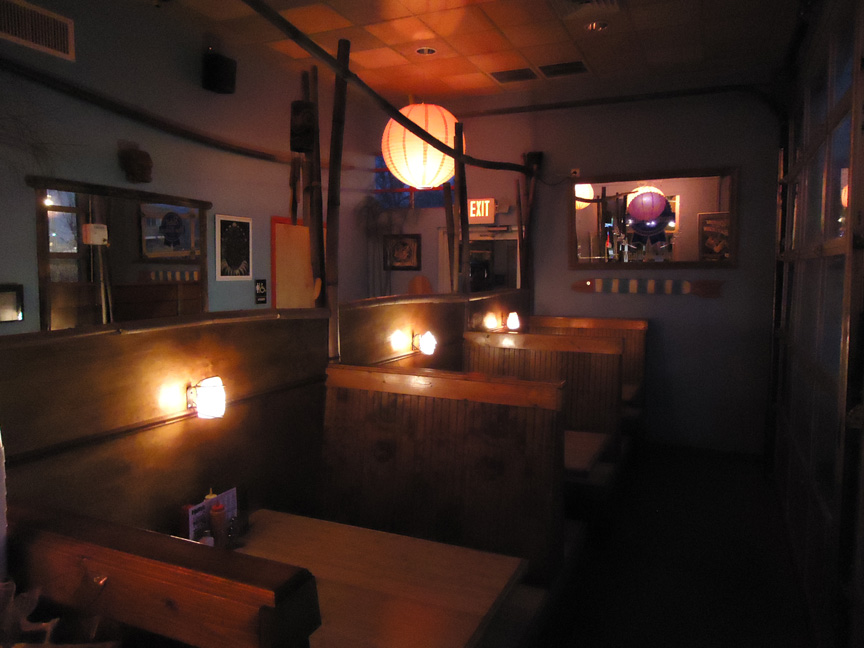
Image resolution: width=864 pixels, height=648 pixels. What are the coordinates of `vents` in the screenshot? It's located at (511, 78), (573, 67).